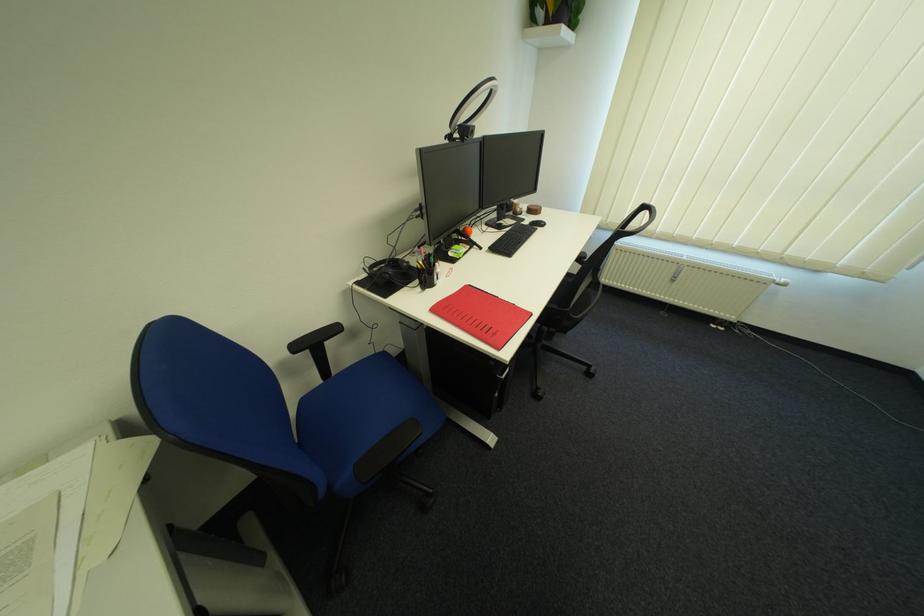
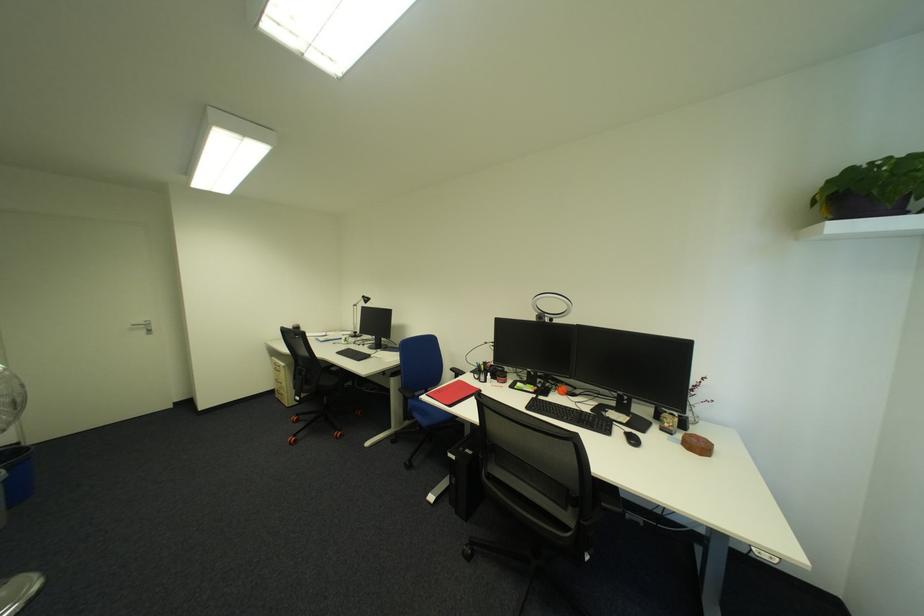
Locate, in the second image, the point that corresponds to pixel 528 209 in the first image.

(677, 424)